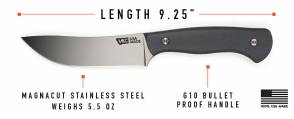
Where is `handle`? This screenshot has height=119, width=294. handle is located at coordinates (200, 38).